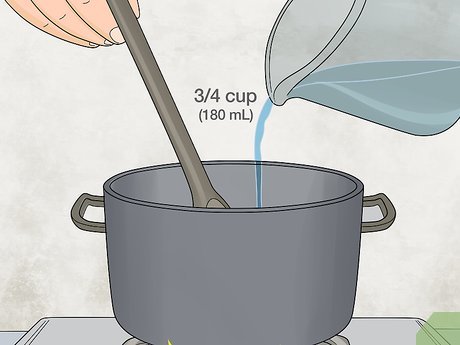
Identify the location of spoon. (164, 106).